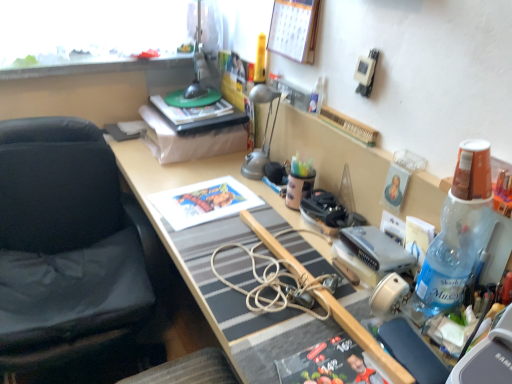
This screenshot has width=512, height=384. What do you see at coordinates (64, 245) in the screenshot?
I see `black fabric chair at left` at bounding box center [64, 245].

Where is `wooden desk at center`? wooden desk at center is located at coordinates (187, 175).

This screenshot has height=384, width=512. I want to click on hardcover book at center, so click(x=191, y=111).

I want to click on picture frame lying behind the blue plastic bottle at right, so click(x=294, y=29).

Can you confirm if wooden calendar at upper center is wider than blue plastic bottle at right?

No, wooden calendar at upper center is not wider than blue plastic bottle at right.

From the picture: From the image's perspective, between wooden calendar at upper center and blue plastic bottle at right, who is located below?

From the image's view, blue plastic bottle at right is below.

Between matte paper print at center and satin silver lamp at center, which one has less height?

matte paper print at center.

Considering the relative sizes of matte paper print at center and satin silver lamp at center in the image provided, is matte paper print at center thinner than satin silver lamp at center?

Incorrect, the width of matte paper print at center is not less than that of satin silver lamp at center.

Considering the relative positions of matte paper print at center and satin silver lamp at center in the image provided, is matte paper print at center to the left of satin silver lamp at center from the viewer's perspective?

Yes, matte paper print at center is to the left of satin silver lamp at center.

How distant is matte paper print at center from satin silver lamp at center?

They are 8.62 inches apart.

Would you say hardcover book at center is part of satin silver lamp at center's contents?

That's incorrect, hardcover book at center is not inside satin silver lamp at center.

Which is in front, satin silver lamp at center or hardcover book at center?

satin silver lamp at center is more forward.

Is point (255, 97) closer or farther from the camera than point (191, 116)?

Point (255, 97) is positioned closer to the camera compared to point (191, 116).

Considering the sizes of objects satin silver lamp at center and hardcover book at center in the image provided, who is shorter, satin silver lamp at center or hardcover book at center?

hardcover book at center is shorter.

Is matte paper print at center closer to camera compared to black fabric chair at left?

That is False.

Which of these two, matte paper print at center or black fabric chair at left, is bigger?

black fabric chair at left is bigger.

Are matte paper print at center and black fabric chair at left far apart?

No.

Considering the relative sizes of matte paper print at center and blue plastic bottle at right in the image provided, is matte paper print at center wider than blue plastic bottle at right?

Correct, the width of matte paper print at center exceeds that of blue plastic bottle at right.

From a real-world perspective, is matte paper print at center physically located above or below blue plastic bottle at right?

In terms of real-world spatial position, matte paper print at center is below blue plastic bottle at right.

How different are the orientations of matte paper print at center and blue plastic bottle at right in degrees?

The facing directions of matte paper print at center and blue plastic bottle at right are 4.38 degrees apart.

Is matte paper print at center not near blue plastic bottle at right?

matte paper print at center is actually quite close to blue plastic bottle at right.

Is point (4, 248) closer or farther from the camera than point (287, 44)?

Clearly, point (4, 248) is more distant from the camera than point (287, 44).

Is black fabric chair at left positioned with its back to wooden calendar at upper center?

No, black fabric chair at left is not facing the opposite direction of wooden calendar at upper center.

Does black fabric chair at left have a larger size compared to wooden calendar at upper center?

Indeed, black fabric chair at left has a larger size compared to wooden calendar at upper center.

From a real-world perspective, which is physically below, black fabric chair at left or wooden calendar at upper center?

black fabric chair at left, from a real-world perspective.

How many degrees apart are the facing directions of wooden desk at center and blue plastic bottle at right?

There is a 2.77-degree angle between the facing directions of wooden desk at center and blue plastic bottle at right.

Is wooden desk at center shorter than blue plastic bottle at right?

Incorrect, the height of wooden desk at center does not fall short of that of blue plastic bottle at right.

Could you tell me if wooden desk at center is turned towards blue plastic bottle at right?

No.

Can you confirm if wooden desk at center is thinner than blue plastic bottle at right?

In fact, wooden desk at center might be wider than blue plastic bottle at right.

You are a GUI agent. You are given a task and a screenshot of the screen. Output one action in this format:
    pyautogui.click(x=<x>, y=<y>)
    Task: Click on the picture frame on the left of blue plastic bottle at right
    
    Given the screenshot: What is the action you would take?
    pyautogui.click(x=294, y=29)

Locate an element on the screen. This screenshot has width=512, height=384. paperback book that is below the satin silver lamp at center (from the image's perspective) is located at coordinates (203, 202).

From the image, which object appears to be nearer to wooden calendar at upper center, matte paper print at center or satin silver lamp at center?

satin silver lamp at center is closer to wooden calendar at upper center.

Based on their spatial positions, is matte paper print at center or wooden desk at center further from silver metallic game console at center-right?

Based on the image, matte paper print at center appears to be further to silver metallic game console at center-right.

From the image, which object appears to be farther from wooden desk at center, blue plastic bottle at right or hardcover book at center?

hardcover book at center lies further to wooden desk at center than the other object.

Estimate the real-world distances between objects in this image. Which object is closer to hardcover book at center, black fabric chair at left or wooden calendar at upper center?

Based on the image, wooden calendar at upper center appears to be nearer to hardcover book at center.

Estimate the real-world distances between objects in this image. Which object is closer to wooden desk at center, satin silver lamp at center or matte paper print at center?

Based on the image, matte paper print at center appears to be nearer to wooden desk at center.

Estimate the real-world distances between objects in this image. Which object is further from satin silver lamp at center, blue plastic bottle at right or matte paper print at center?

Based on the image, blue plastic bottle at right appears to be further to satin silver lamp at center.

Estimate the real-world distances between objects in this image. Which object is further from matte paper print at center, wooden calendar at upper center or silver metallic game console at center-right?

wooden calendar at upper center is positioned further to the anchor matte paper print at center.

From the picture: When comparing their distances from black fabric chair at left, does silver metallic game console at center-right or hardcover book at center seem closer?

hardcover book at center.

Image resolution: width=512 pixels, height=384 pixels. I want to click on book between wooden calendar at upper center and black fabric chair at left in the vertical direction, so click(191, 111).

The height and width of the screenshot is (384, 512). I want to click on paperback book between wooden calendar at upper center and silver metallic game console at center-right from top to bottom, so click(203, 202).

Where is `lamp between wooden calendar at upper center and black fabric chair at left vertically`? The width and height of the screenshot is (512, 384). lamp between wooden calendar at upper center and black fabric chair at left vertically is located at coordinates (263, 135).

Locate an element on the screen. lamp located between black fabric chair at left and hardcover book at center in the depth direction is located at coordinates (263, 135).